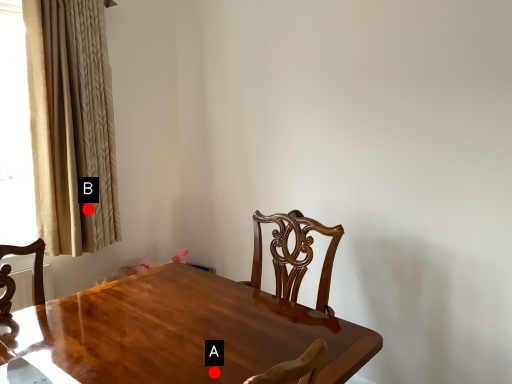
Question: Two points are circled on the image, labeled by A and B beside each circle. Among these points, which one is nearest to the camera?

Choices:
 (A) A is closer
 (B) B is closer

Answer: (A)